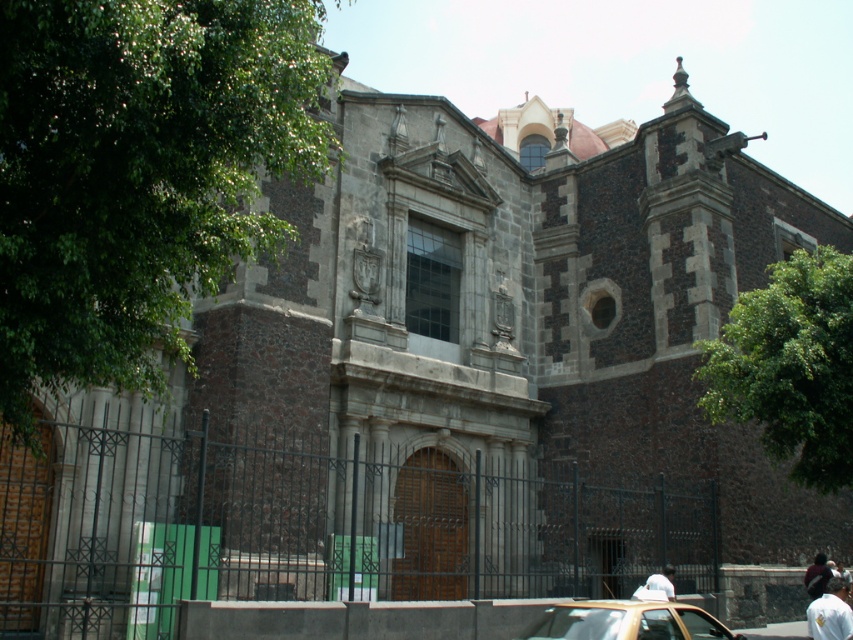
Can you confirm if white fabric shirt at lower right is taller than dark brown leather jacket at center?

Correct, white fabric shirt at lower right is much taller as dark brown leather jacket at center.

Is point (809, 611) positioned in front of point (825, 564)?

Yes, it is.

The height and width of the screenshot is (640, 853). I want to click on white fabric shirt at lower right, so click(x=830, y=612).

Does gold metallic car at lower center have a smaller size compared to white fabric shirt at lower right?

Actually, gold metallic car at lower center might be larger than white fabric shirt at lower right.

Is point (665, 609) in front of point (827, 628)?

Yes, point (665, 609) is closer to viewer.

Where is `gold metallic car at lower center`? The image size is (853, 640). gold metallic car at lower center is located at coordinates (625, 621).

Is gold metallic car at lower center to the right of dark brown leather jacket at center from the viewer's perspective?

No, gold metallic car at lower center is not to the right of dark brown leather jacket at center.

Is point (561, 605) positioned in front of point (819, 577)?

Yes, point (561, 605) is in front of point (819, 577).

Does point (596, 618) come in front of point (808, 588)?

Yes, it is.

This screenshot has height=640, width=853. Identify the location of gold metallic car at lower center. (625, 621).